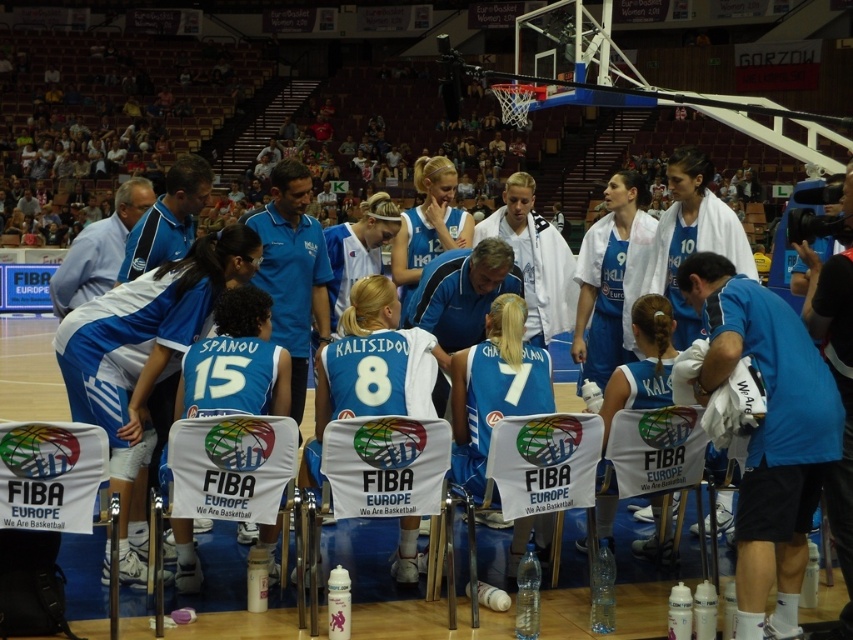
Question: Is blue fabric shirt at center thinner than white jersey at center?

Choices:
 (A) yes
 (B) no

Answer: (A)

Question: Can you confirm if white jersey at center is smaller than matte blue jersey at center?

Choices:
 (A) no
 (B) yes

Answer: (A)

Question: Which object appears closest to the camera in this image?

Choices:
 (A) white jersey at center
 (B) matte blue jersey at center

Answer: (A)

Question: Which object appears closest to the camera in this image?

Choices:
 (A) blue fabric shirt at center
 (B) white jersey at center
 (C) matte blue jersey at center

Answer: (A)

Question: Which of the following is the closest to the observer?

Choices:
 (A) white jersey at center
 (B) matte blue jersey at center

Answer: (A)

Question: Can you confirm if white jersey at center is bigger than matte blue jersey at center?

Choices:
 (A) no
 (B) yes

Answer: (B)